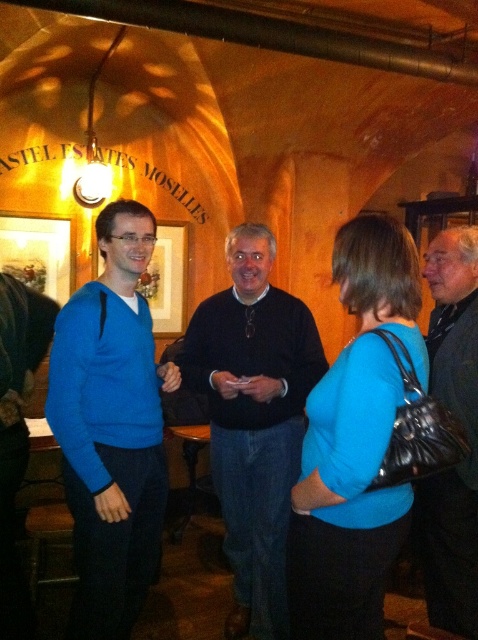
Does matte blue sweater at left have a lesser height compared to dark blue sweater at center?

Indeed, matte blue sweater at left has a lesser height compared to dark blue sweater at center.

Identify the location of matte blue sweater at left. The image size is (478, 640). (111, 428).

Identify the location of matte blue sweater at left. The image size is (478, 640). (111, 428).

Is dark blue sweater at center to the left of black leather jacket at right from the viewer's perspective?

Yes, dark blue sweater at center is to the left of black leather jacket at right.

Is point (212, 468) farther from camera compared to point (437, 353)?

Yes, point (212, 468) is behind point (437, 353).

Who is more forward, (260, 618) or (463, 264)?

Point (463, 264) is in front.

Find the location of a particular element. dark blue sweater at center is located at coordinates (253, 419).

Is matte blue sweater at left thinner than black leather jacket at right?

In fact, matte blue sweater at left might be wider than black leather jacket at right.

Between matte blue sweater at left and black leather jacket at right, which one appears on the left side from the viewer's perspective?

Positioned to the left is matte blue sweater at left.

Find the location of a particular element. The height and width of the screenshot is (640, 478). matte blue sweater at left is located at coordinates (111, 428).